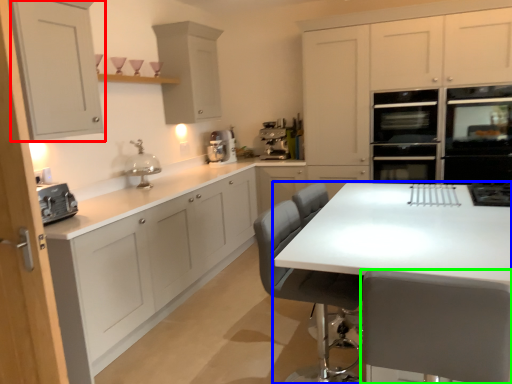
Question: Which is nearer to the cabinetry (highlighted by a red box)? table (highlighted by a blue box) or chair (highlighted by a green box).

Choices:
 (A) table
 (B) chair

Answer: (A)